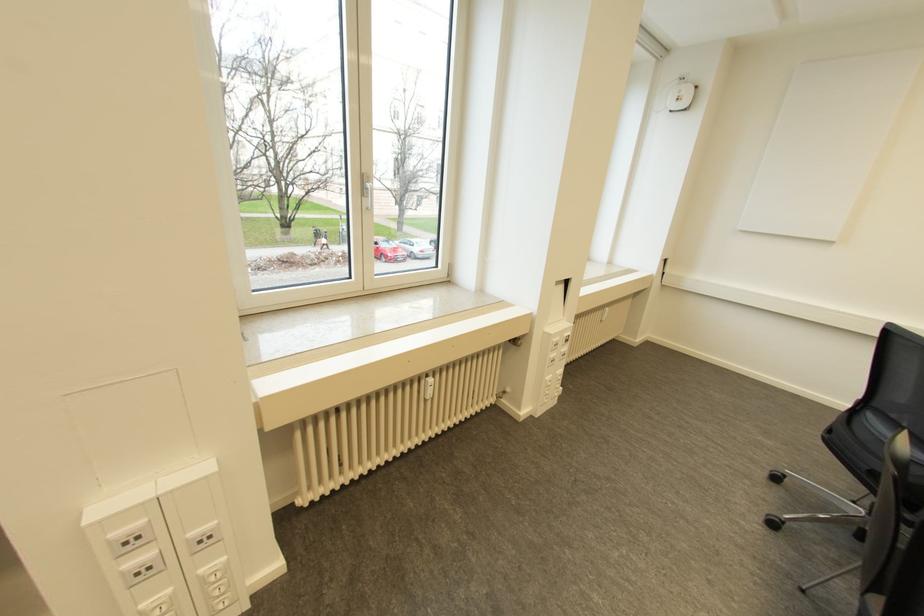
Find the location of a particular element. The width and height of the screenshot is (924, 616). white window handle is located at coordinates (366, 191).